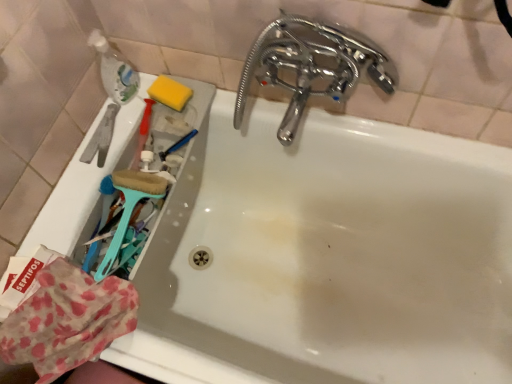
Where is `free location in front of yellow sponge at upper left`? The width and height of the screenshot is (512, 384). free location in front of yellow sponge at upper left is located at coordinates (155, 142).